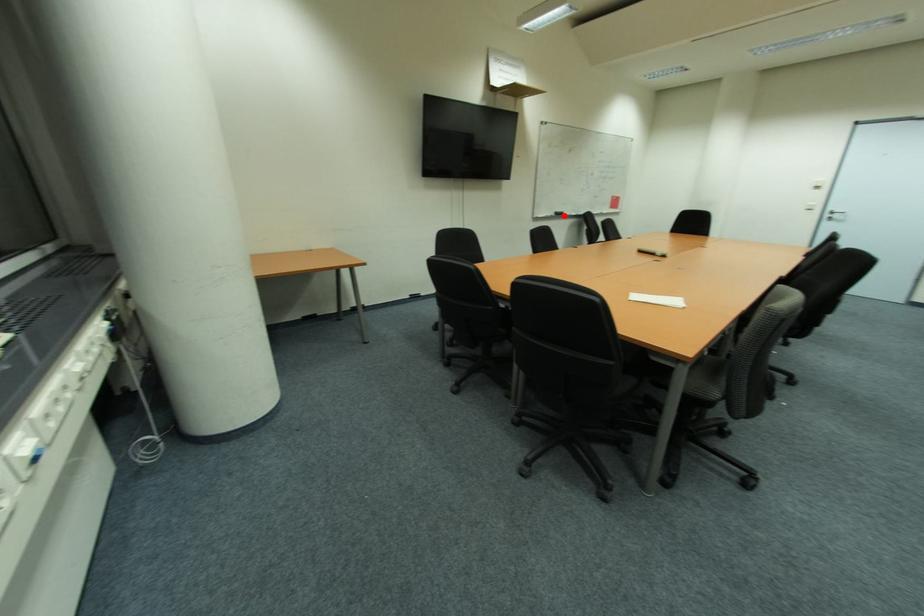
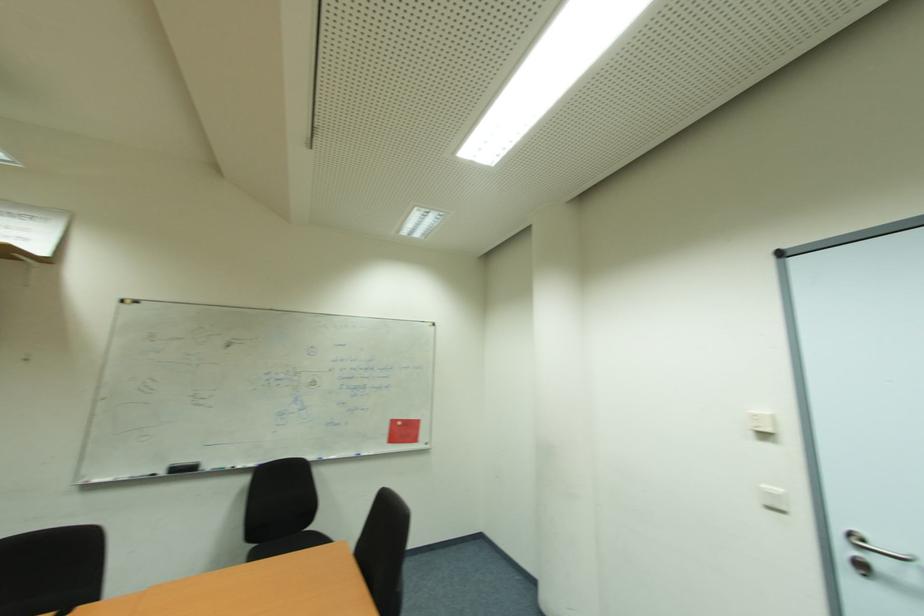
Question: I am providing you with two images of the same scene from different viewpoints. A red point is shown in image1. For the corresponding object point in image2, is it positioned nearer or farther from the camera?

Choices:
 (A) Nearer
 (B) Farther

Answer: (B)